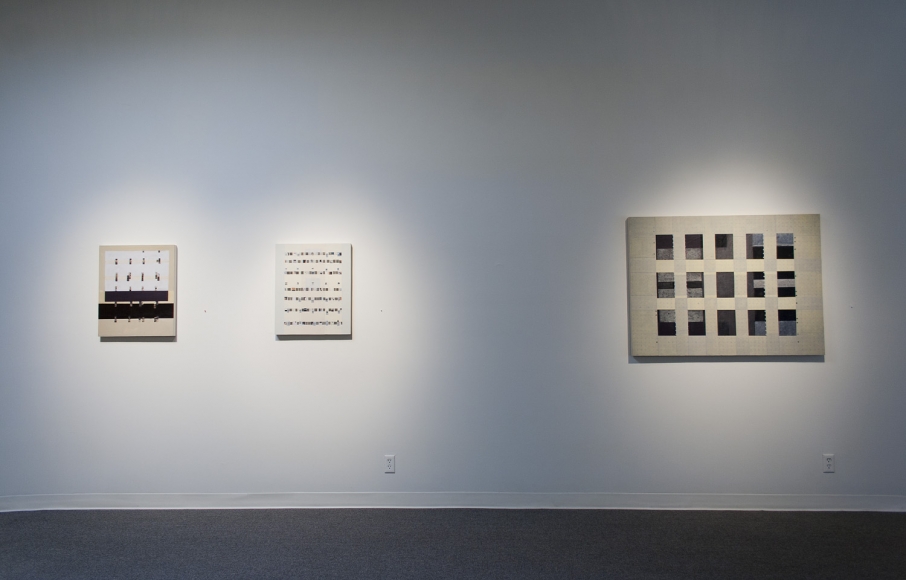
This screenshot has height=580, width=906. I want to click on bottom edges of canvases, so click(135, 338), click(314, 336), click(728, 356).